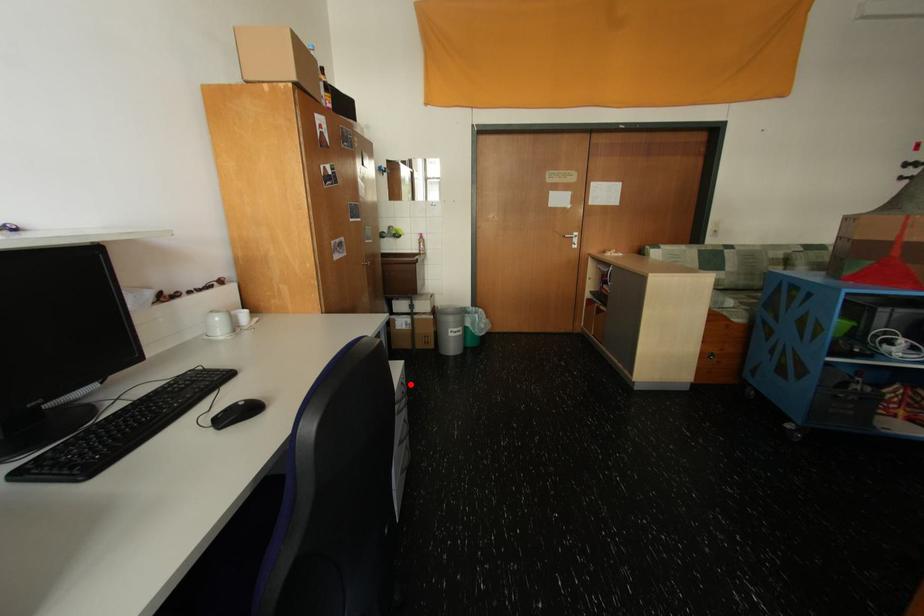
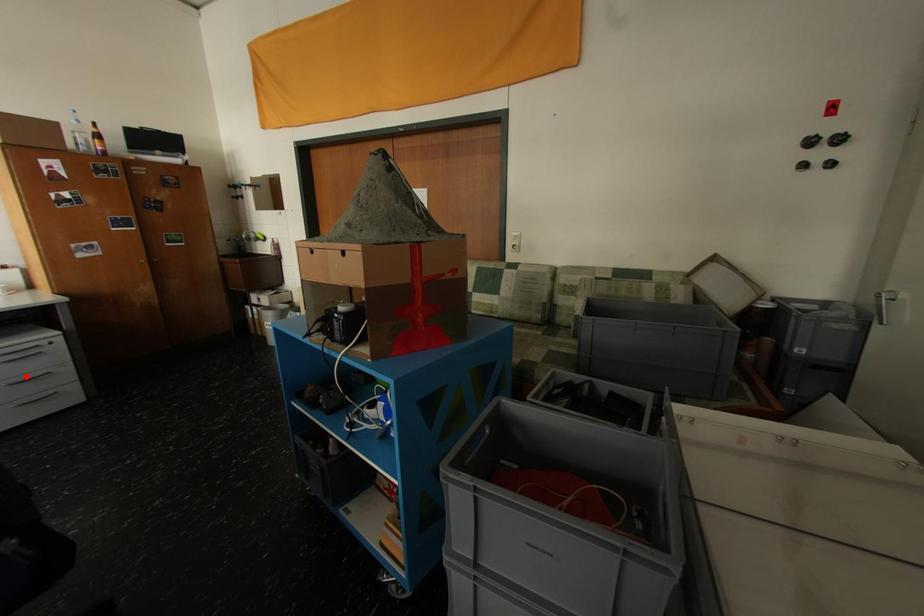
I am providing you with two images of the same scene from different viewpoints. A red point is marked on the first image and another point is marked on the second image. Do the highlighted points in image1 and image2 indicate the same real-world spot?

No